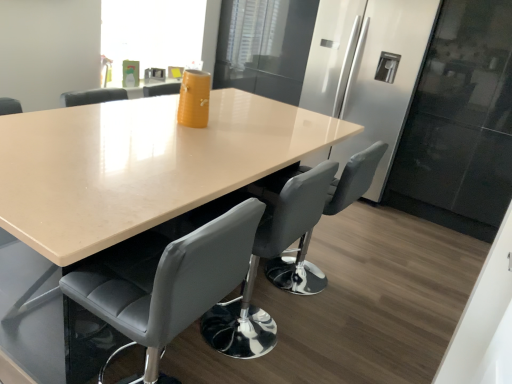
Question: Is gray leather chair at center, placed as the 2th chair when sorted from front to back, in front of or behind sleek stainless steel fridge at center in the image?

Choices:
 (A) front
 (B) behind

Answer: (A)

Question: Is gray leather chair at center, placed as the 2th chair when sorted from front to back, to the left or to the right of sleek stainless steel fridge at center in the image?

Choices:
 (A) left
 (B) right

Answer: (A)

Question: Based on their relative distances, which object is nearer to the transparent glass window screen at upper center?

Choices:
 (A) gray leather chair at center, the first chair in the back-to-front sequence
 (B) gray leather chair at center, the second chair viewed from the back
 (C) sleek stainless steel fridge at center
 (D) beige glossy table at center

Answer: (C)

Question: Which of these objects is positioned closest to the gray leather chair at center, the second chair viewed from the back?

Choices:
 (A) beige glossy table at center
 (B) gray leather chair at center, placed as the 2th chair when sorted from front to back
 (C) sleek stainless steel fridge at center
 (D) transparent glass window screen at upper center

Answer: (B)